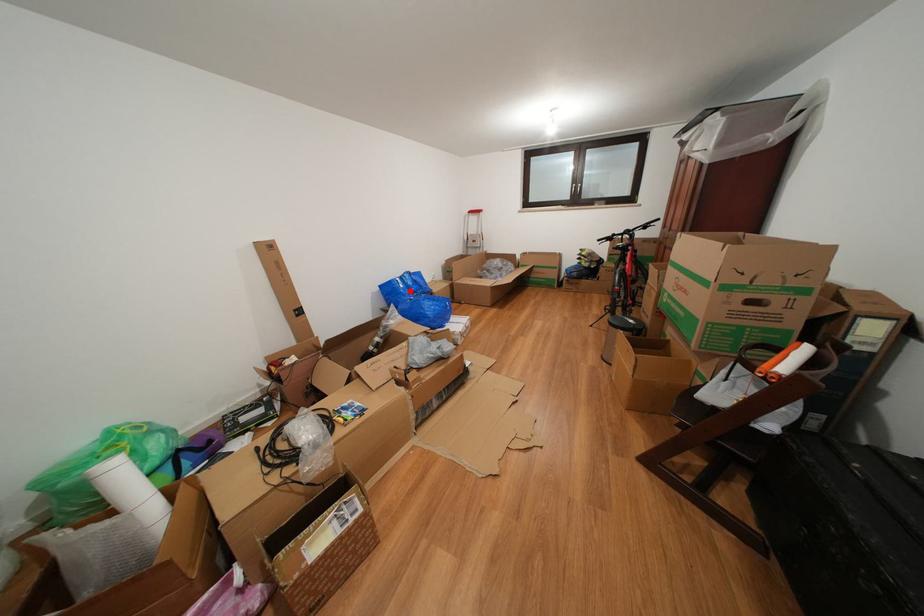
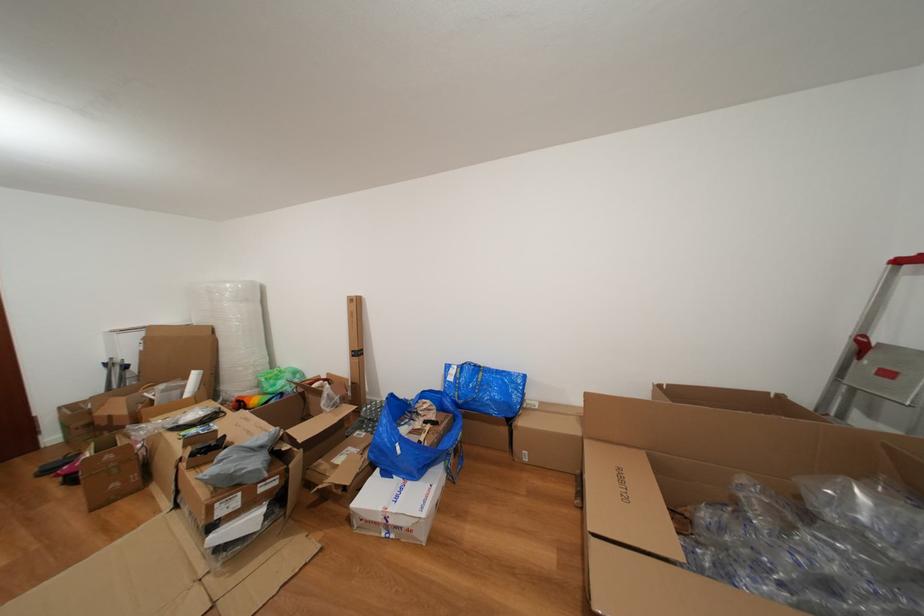
Question: A red point is marked in image1. In image2, is the corresponding 3D point closer to the camera or farther? Reply with the corresponding letter.

Choices:
 (A) The corresponding 3D point is closer.
 (B) The corresponding 3D point is farther.

Answer: (B)